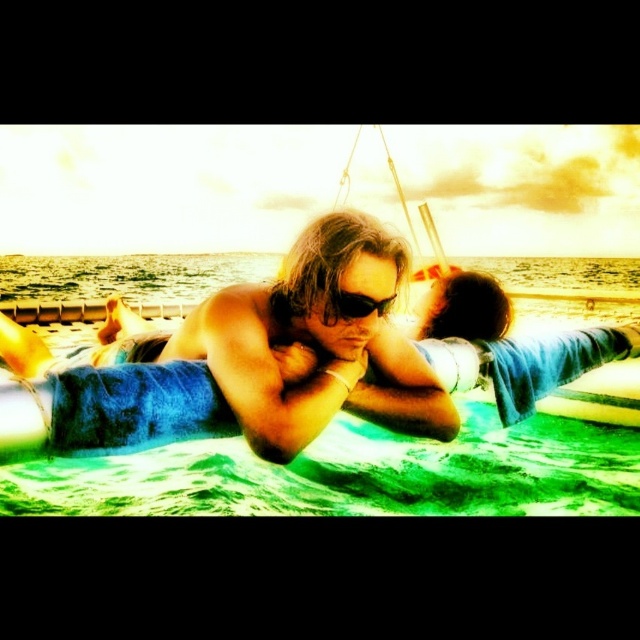
You are a photographer trying to capture the sunset while ensuring both the blue towel at center and the black plastic goggles at center are visible in the frame. Which object should you position closer to the left side of your camera viewfinder to include both items without cropping?

Position the black plastic goggles at center closer to the left side of your camera viewfinder since the blue towel at center is to the right of the black plastic goggles at center, allowing both to fit within the frame.

You are standing on the floating platform and want to place a small cooler between the two points marked as point (214, 403) and point (349, 317). Which point should you move towards if you want the cooler to be closer to the person on the left who is shirtless and wearing sunglasses?

You should move towards point (214, 403) because it is closer to the camera and thus closer to the person on the left who is shirtless and wearing sunglasses.